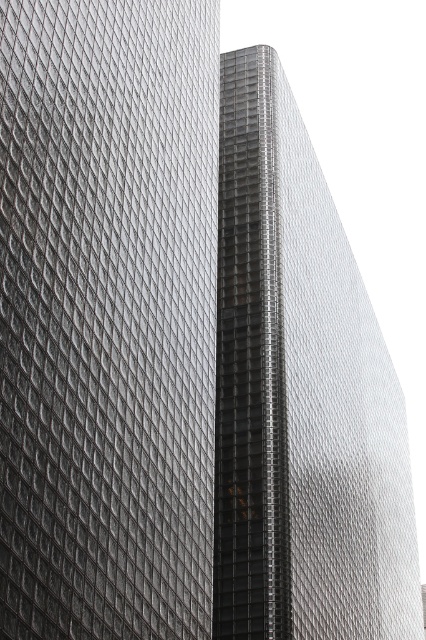
Is point (89, 493) positioned in front of point (230, 369)?

Yes, it is.

Between metallic glass skyscraper at left and metallic glass tower at center, which one appears on the right side from the viewer's perspective?

metallic glass tower at center is more to the right.

Does point (132, 61) come closer to viewer compared to point (267, 538)?

Yes, it is in front of point (267, 538).

This screenshot has width=426, height=640. In order to click on metallic glass skyscraper at left in this screenshot , I will do `click(108, 317)`.